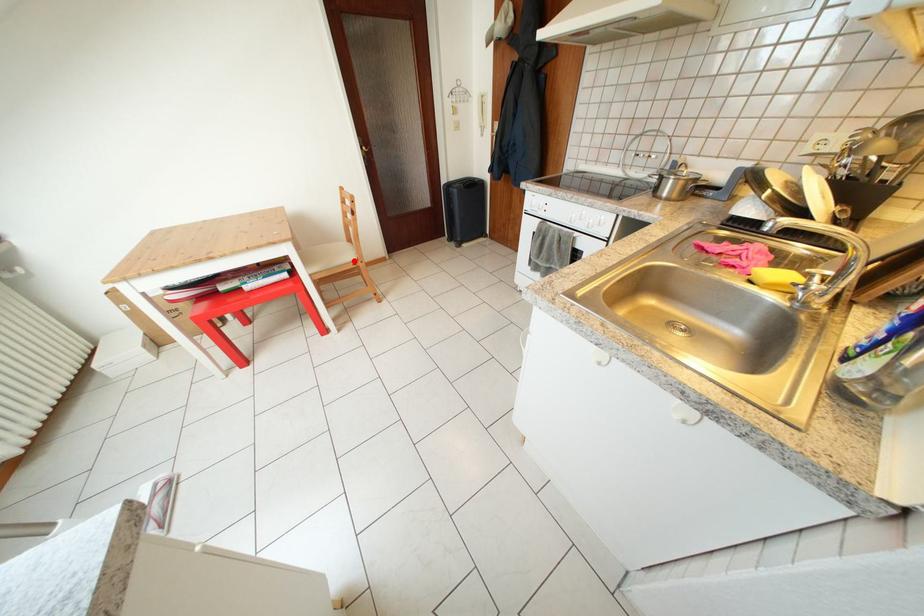
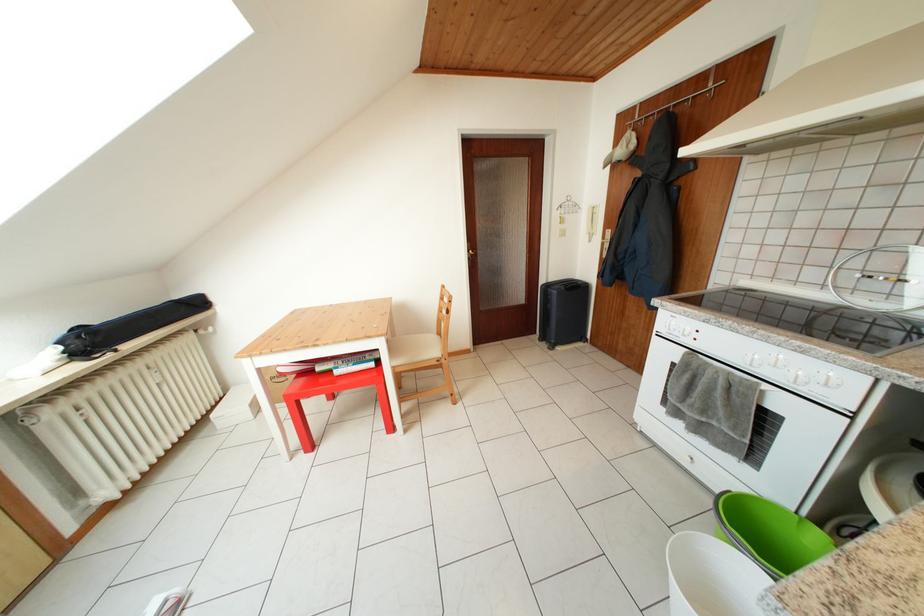
Question: A red point is marked in image1. In image2, is the corresponding 3D point closer to the camera or farther? Reply with the corresponding letter.

Choices:
 (A) The corresponding 3D point is closer.
 (B) The corresponding 3D point is farther.

Answer: (B)